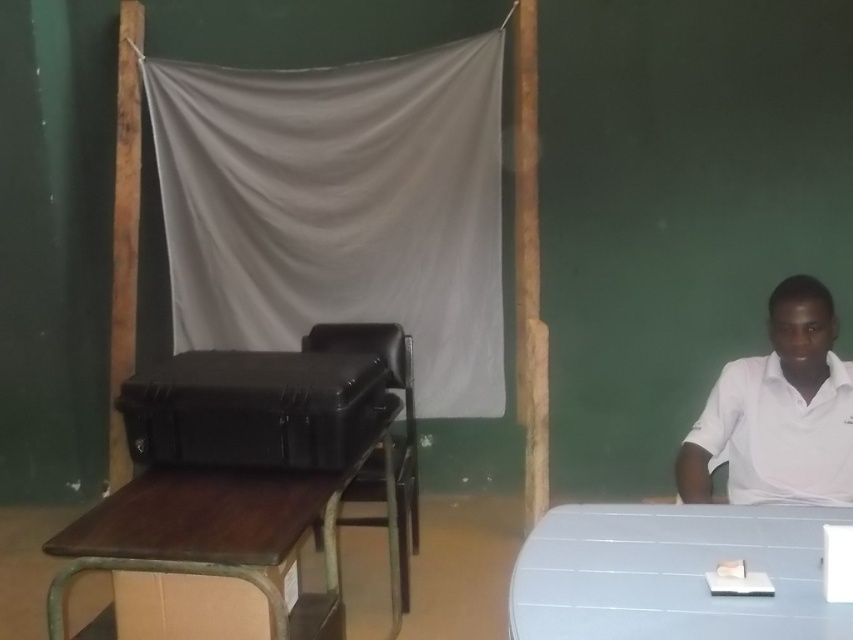
Does gray fabric at center appear under black leather chair at center?

No, gray fabric at center is not below black leather chair at center.

Which is more to the right, gray fabric at center or black leather chair at center?

black leather chair at center is more to the right.

Who is more distant from viewer, (372, 170) or (396, 474)?

The point (372, 170) is more distant.

Find the location of a particular element. The width and height of the screenshot is (853, 640). gray fabric at center is located at coordinates (340, 209).

Is black hard case at center smaller than black leather chair at center?

Yes.

Does point (358, 451) come farther from viewer compared to point (398, 353)?

No, (358, 451) is closer to viewer.

Identify the location of black hard case at center. (254, 408).

Does gray fabric at center have a smaller size compared to white matte shirt at right?

Actually, gray fabric at center might be larger than white matte shirt at right.

Does gray fabric at center have a lesser height compared to white matte shirt at right?

Incorrect, gray fabric at center's height does not fall short of white matte shirt at right's.

Is point (422, 372) closer to viewer compared to point (724, 392)?

No, (422, 372) is further to viewer.

Image resolution: width=853 pixels, height=640 pixels. Identify the location of gray fabric at center. (340, 209).